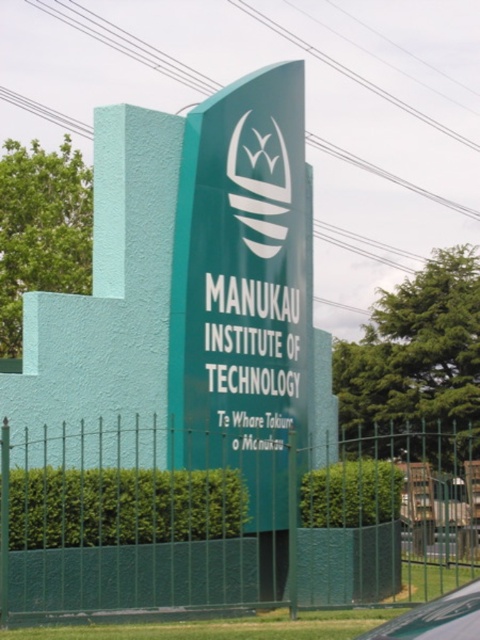
Does green leafy hedge at lower center come behind green leafy hedge at center?

No, it is in front of green leafy hedge at center.

Is green leafy hedge at lower center to the right of green leafy hedge at center from the viewer's perspective?

In fact, green leafy hedge at lower center is to the left of green leafy hedge at center.

Who is more forward, (232, 529) or (365, 497)?

Positioned in front is point (232, 529).

What are the coordinates of `green leafy hedge at lower center` in the screenshot? It's located at (122, 506).

Does point (268, 586) lie behind point (350, 480)?

Yes.

Which of these two, green metal fence at lower center or green leafy hedge at center, stands taller?

green metal fence at lower center

What do you see at coordinates (241, 531) in the screenshot?
I see `green metal fence at lower center` at bounding box center [241, 531].

Find the location of `green metal fence at lower center`. green metal fence at lower center is located at coordinates (241, 531).

Is the position of green metal fence at lower center less distant than that of green leafy hedge at lower center?

Yes, it is in front of green leafy hedge at lower center.

Is green metal fence at lower center wider than green leafy hedge at lower center?

Indeed, green metal fence at lower center has a greater width compared to green leafy hedge at lower center.

Locate an element on the screen. This screenshot has width=480, height=640. green metal fence at lower center is located at coordinates (241, 531).

The width and height of the screenshot is (480, 640). I want to click on green metal fence at lower center, so click(241, 531).